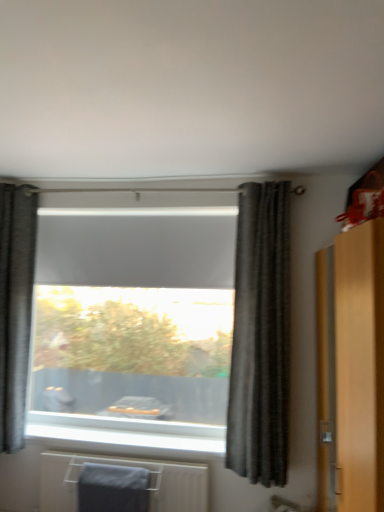
Question: From a real-world perspective, is gray fabric bath towel at lower left positioned above or below dark gray textured curtain at center, placed as the 2th curtain when sorted from left to right?

Choices:
 (A) above
 (B) below

Answer: (B)

Question: From the image's perspective, is gray fabric bath towel at lower left located above or below dark gray textured curtain at center, acting as the first curtain starting from the front?

Choices:
 (A) below
 (B) above

Answer: (A)

Question: Which is farther from the gray matte blind at center?

Choices:
 (A) dark gray textured curtain at center, which is the second curtain from back to front
 (B) matte wooden dresser at right
 (C) gray fabric bath towel at lower left
 (D) dark gray textured curtain at left, the first curtain positioned from the left
 (E) gray matte towel at lower center

Answer: (B)

Question: Which object is positioned farthest from the gray matte blind at center?

Choices:
 (A) gray matte towel at lower center
 (B) dark gray textured curtain at left, marked as the 1th curtain in a back-to-front arrangement
 (C) gray fabric bath towel at lower left
 (D) matte wooden dresser at right
 (E) dark gray textured curtain at center, acting as the first curtain starting from the front

Answer: (D)